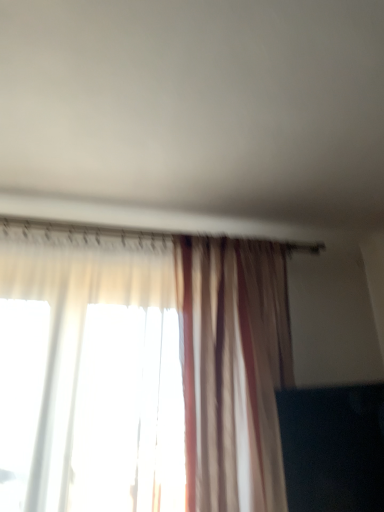
Question: Does translucent striped curtain at center come behind black glossy tv at lower right?

Choices:
 (A) yes
 (B) no

Answer: (B)

Question: From the image's perspective, is translucent striped curtain at center beneath black glossy tv at lower right?

Choices:
 (A) no
 (B) yes

Answer: (A)

Question: Does translucent striped curtain at center appear on the left side of black glossy tv at lower right?

Choices:
 (A) no
 (B) yes

Answer: (B)

Question: From a real-world perspective, does translucent striped curtain at center stand above black glossy tv at lower right?

Choices:
 (A) no
 (B) yes

Answer: (B)

Question: Would you say black glossy tv at lower right is part of translucent striped curtain at center's contents?

Choices:
 (A) no
 (B) yes

Answer: (B)

Question: Would you consider translucent striped curtain at center to be distant from black glossy tv at lower right?

Choices:
 (A) yes
 (B) no

Answer: (B)

Question: Can you confirm if black glossy tv at lower right is positioned to the left of translucent striped curtain at center?

Choices:
 (A) no
 (B) yes

Answer: (A)

Question: Is translucent striped curtain at center located within black glossy tv at lower right?

Choices:
 (A) yes
 (B) no

Answer: (B)

Question: Is black glossy tv at lower right facing away from translucent striped curtain at center?

Choices:
 (A) yes
 (B) no

Answer: (A)

Question: Is black glossy tv at lower right positioned in front of translucent striped curtain at center?

Choices:
 (A) yes
 (B) no

Answer: (B)

Question: Does black glossy tv at lower right lie behind translucent striped curtain at center?

Choices:
 (A) yes
 (B) no

Answer: (A)

Question: Is black glossy tv at lower right bigger than translucent striped curtain at center?

Choices:
 (A) yes
 (B) no

Answer: (B)

Question: Is translucent striped curtain at center taller or shorter than black glossy tv at lower right?

Choices:
 (A) tall
 (B) short

Answer: (A)